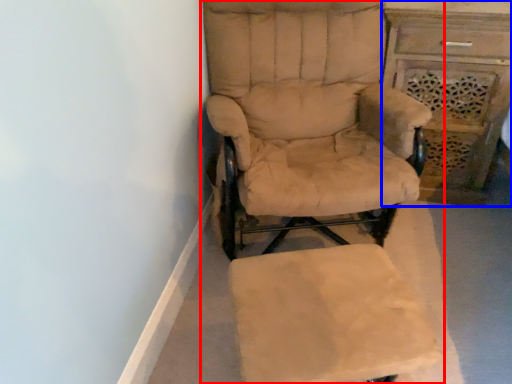
Question: Which object appears farthest to the camera in this image, chair (highlighted by a red box) or vanity (highlighted by a blue box)?

Choices:
 (A) chair
 (B) vanity

Answer: (B)